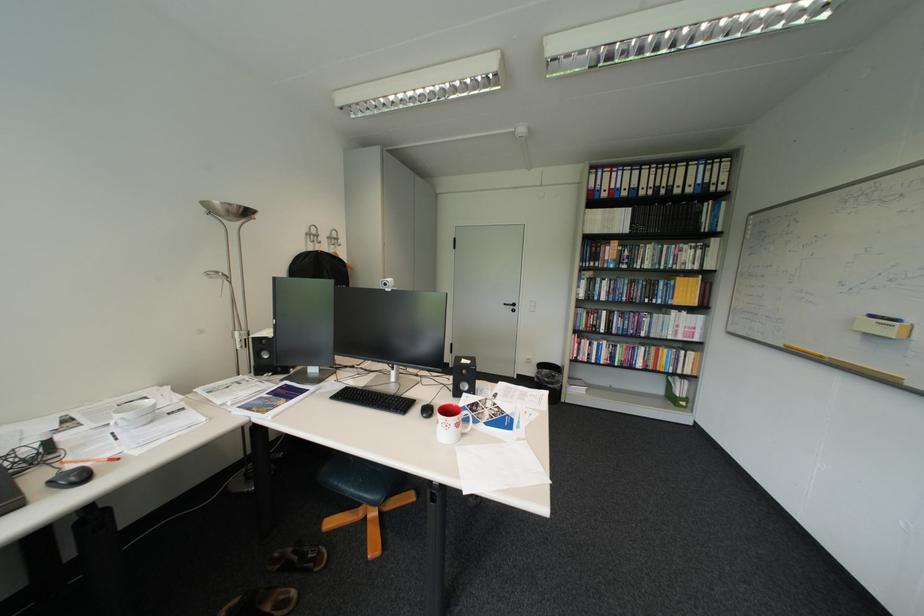
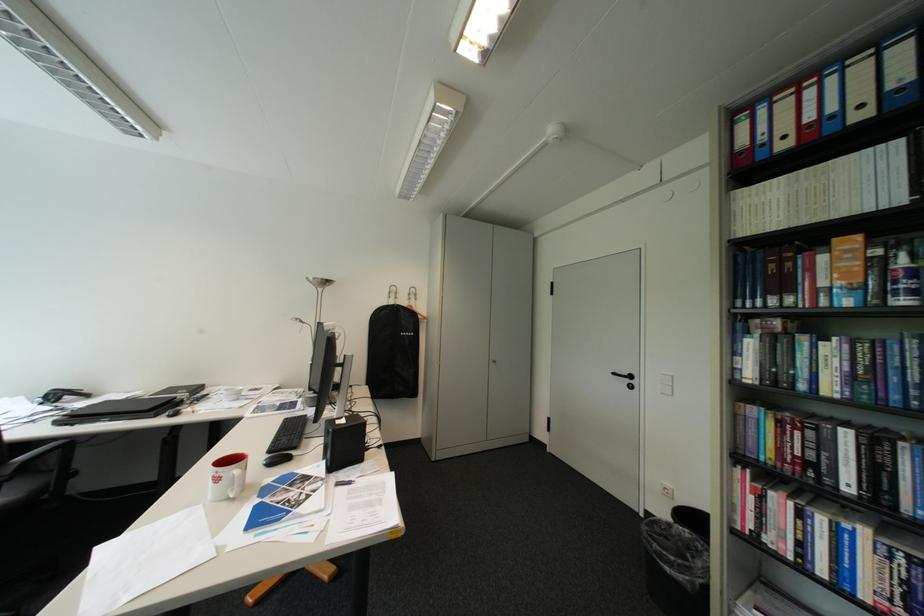
Find the pixel in the second image that matches point (625, 187) in the first image.

(821, 119)